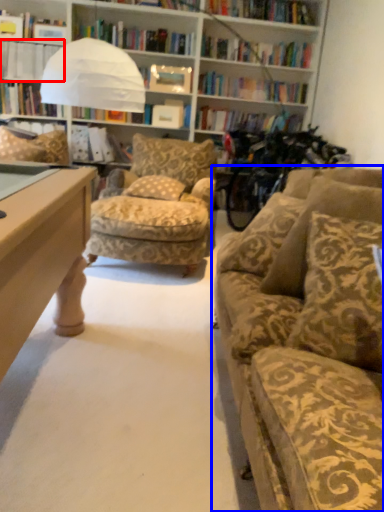
Question: Among these objects, which one is nearest to the camera, book (highlighted by a red box) or studio couch (highlighted by a blue box)?

Choices:
 (A) book
 (B) studio couch

Answer: (B)